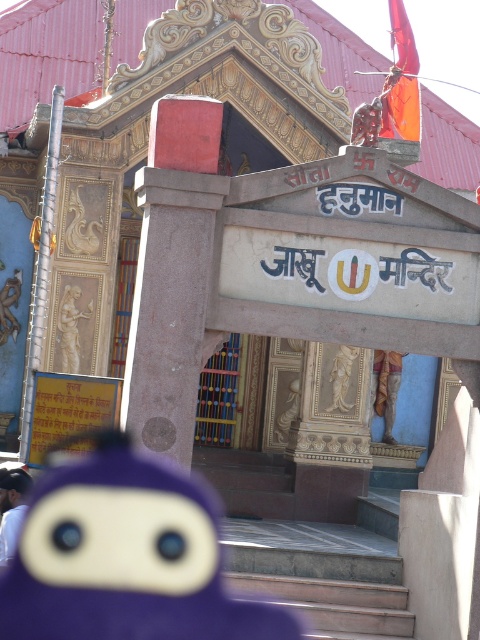
You are a visitor approaching the temple entrance and notice the blue fabric cap at lower left and the carved stone statue at center. Which object appears taller from your perspective?

The carved stone statue at center appears taller than the blue fabric cap at lower left.

You are a visitor at the temple entrance and want to place a small offering on the signboard. The signboard has two items already present. Which item is positioned lower down between the purple plush toy at center and the blue fabric cap at lower left?

The purple plush toy at center is positioned lower down than the blue fabric cap at lower left.